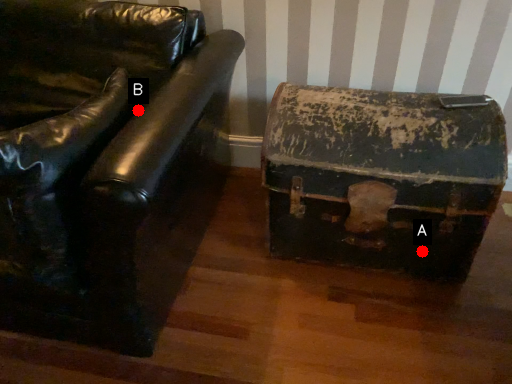
Question: Two points are circled on the image, labeled by A and B beside each circle. Which of the following is the closest to the observer?

Choices:
 (A) A is closer
 (B) B is closer

Answer: (B)